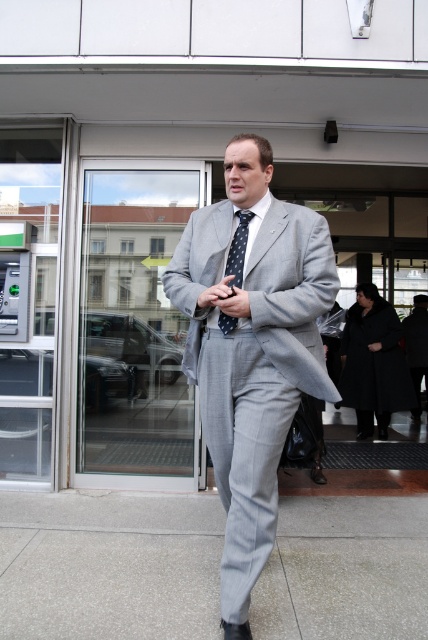
Can you confirm if black wool coat at lower right is thinner than polka dot silk tie at center?

No, black wool coat at lower right is not thinner than polka dot silk tie at center.

Who is more forward, [382,314] or [231,320]?

Point [231,320] is in front.

Where is `black wool coat at lower right`? The width and height of the screenshot is (428, 640). black wool coat at lower right is located at coordinates [374, 362].

Is point (183, 250) behind point (232, 240)?

Yes.

Between point (326, 227) and point (229, 324), which one is positioned behind?

Positioned behind is point (326, 227).

Who is more forward, (272, 168) or (237, 280)?

Point (237, 280)

You are a GUI agent. You are given a task and a screenshot of the screen. Output one action in this format:
    pyautogui.click(x=<x>, y=<y>)
    Task: Click on the gray pinstripe suit at center
    Image resolution: width=428 pixels, height=640 pixels.
    Given the screenshot: What is the action you would take?
    pyautogui.click(x=250, y=348)

Can you confirm if gray concrete pavement at lower center is positioned to the right of gray pinstripe suit at center?

In fact, gray concrete pavement at lower center is to the left of gray pinstripe suit at center.

Looking at this image, can you confirm if gray concrete pavement at lower center is wider than gray pinstripe suit at center?

Indeed, gray concrete pavement at lower center has a greater width compared to gray pinstripe suit at center.

Who is more forward, [142,520] or [240,468]?

Point [240,468] is more forward.

Find the location of a particular element. gray concrete pavement at lower center is located at coordinates (109, 564).